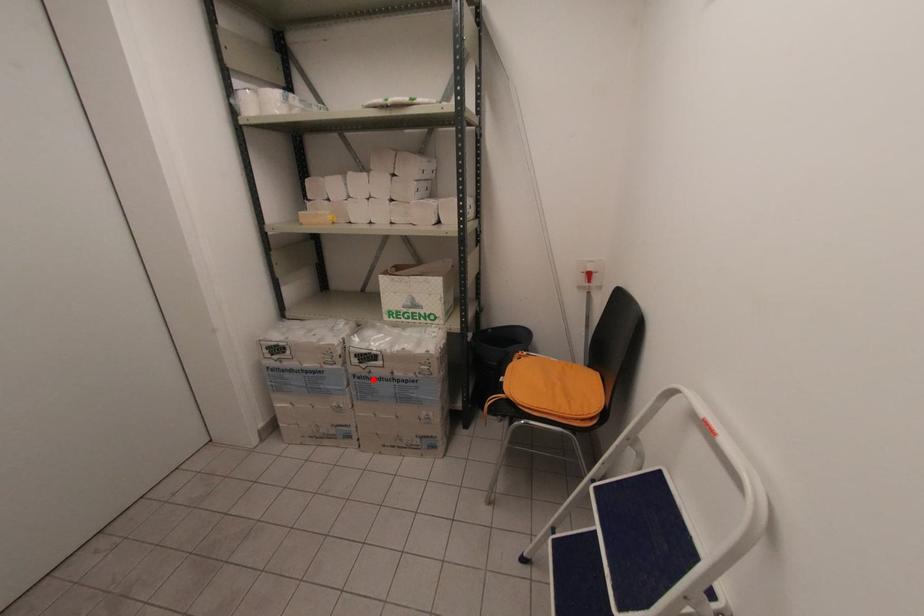
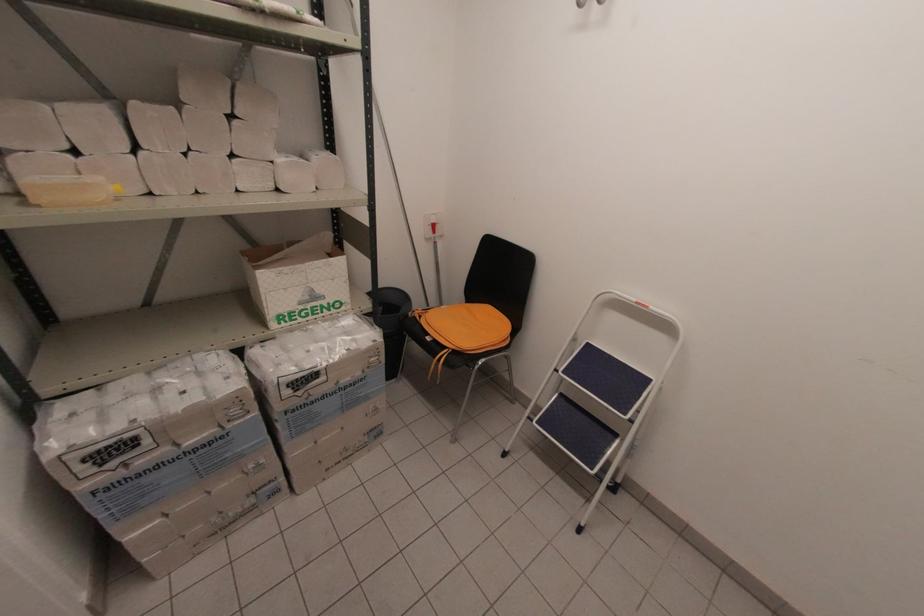
Where in the second image is the point corresponding to the highlighted location from the first image?

(312, 403)